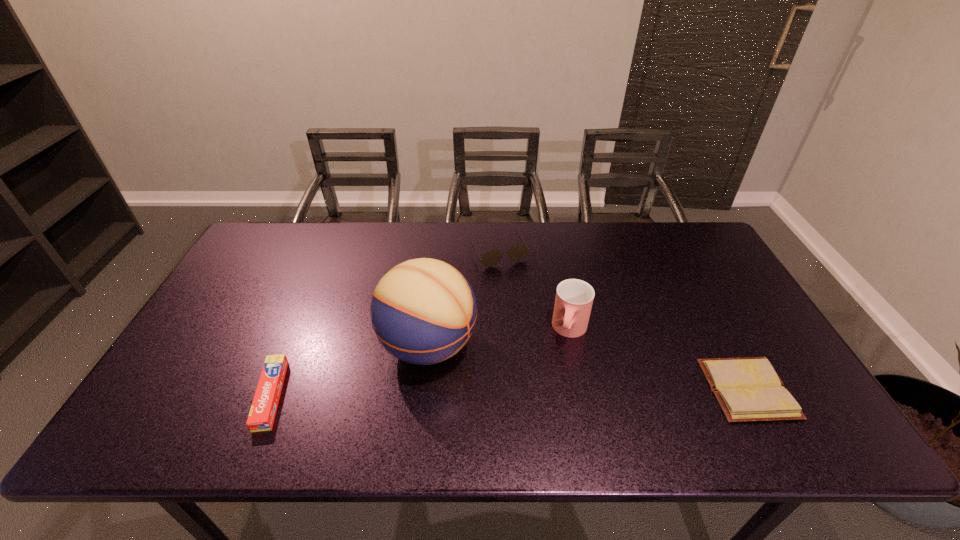
Where is `vacant area situated on the back of the shortest object`? Image resolution: width=960 pixels, height=540 pixels. vacant area situated on the back of the shortest object is located at coordinates (x=680, y=262).

You are a GUI agent. You are given a task and a screenshot of the screen. Output one action in this format:
    pyautogui.click(x=<x>, y=<y>)
    Task: Click on the blank space located 0.190m on the front-facing side of the sunglasses
    This screenshot has height=540, width=960.
    Given the screenshot: What is the action you would take?
    pyautogui.click(x=531, y=309)

The height and width of the screenshot is (540, 960). In order to click on vacant space located on the front-facing side of the sunglasses in this screenshot , I will do `click(535, 316)`.

Locate an element on the screen. blank space located on the front-facing side of the sunglasses is located at coordinates (533, 311).

Locate an element on the screen. This screenshot has width=960, height=540. vacant point located on the patterned surface of the tallest object is located at coordinates (516, 388).

Find the location of `free space located on the patterned surface of the tallest object`. free space located on the patterned surface of the tallest object is located at coordinates (498, 380).

Where is `free location located on the patterned surface of the tallest object`? This screenshot has height=540, width=960. free location located on the patterned surface of the tallest object is located at coordinates (491, 376).

The image size is (960, 540). In order to click on free location located 0.180m on the side of the second object from right to left with the handle in this screenshot , I will do `click(552, 404)`.

At what (x,y) coordinates should I click in order to perform the action: click on free spot located 0.090m on the side of the second object from right to left with the handle. Please return your answer as a coordinate pair (x, y). The width and height of the screenshot is (960, 540). Looking at the image, I should click on (561, 374).

I want to click on vacant space located on the side of the second object from right to left with the handle, so click(x=554, y=397).